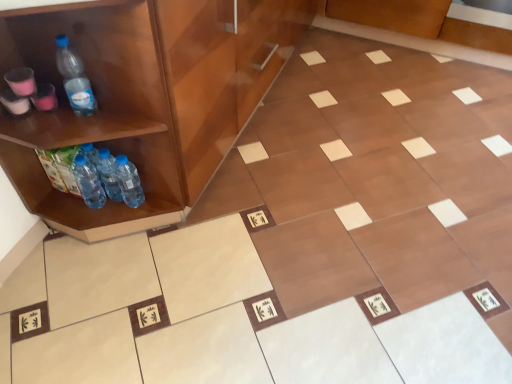
Question: From the image's perspective, is translucent plastic bottles at left, the second bottle positioned from the right, under transparent plastic bottle at left, the 3th bottle positioned from the right?

Choices:
 (A) yes
 (B) no

Answer: (A)

Question: Is translucent plastic bottles at left, the second bottle positioned from the right, looking in the opposite direction of transparent plastic bottle at left, acting as the second bottle starting from the left?

Choices:
 (A) no
 (B) yes

Answer: (A)

Question: Is translucent plastic bottles at left, acting as the third bottle starting from the left, outside transparent plastic bottle at left, acting as the second bottle starting from the left?

Choices:
 (A) no
 (B) yes

Answer: (B)

Question: Considering the relative sizes of translucent plastic bottles at left, the second bottle positioned from the right, and transparent plastic bottle at left, the 3th bottle positioned from the right, in the image provided, is translucent plastic bottles at left, the second bottle positioned from the right, shorter than transparent plastic bottle at left, the 3th bottle positioned from the right,?

Choices:
 (A) no
 (B) yes

Answer: (B)

Question: Is translucent plastic bottles at left, the second bottle positioned from the right, wider than transparent plastic bottle at left, acting as the second bottle starting from the left?

Choices:
 (A) yes
 (B) no

Answer: (A)

Question: Is translucent plastic bottles at left, the second bottle positioned from the right, aimed at transparent plastic bottle at left, the 3th bottle positioned from the right?

Choices:
 (A) yes
 (B) no

Answer: (B)

Question: Can we say translucent plastic bottles at left, the second bottle positioned from the right, lies outside translucent plastic bottles at lower left, the first bottle viewed from the right?

Choices:
 (A) yes
 (B) no

Answer: (A)

Question: Is translucent plastic bottles at left, the second bottle positioned from the right, wider than translucent plastic bottles at lower left, placed as the fourth bottle when sorted from left to right?

Choices:
 (A) no
 (B) yes

Answer: (A)

Question: Can you confirm if translucent plastic bottles at left, the second bottle positioned from the right, is bigger than translucent plastic bottles at lower left, placed as the fourth bottle when sorted from left to right?

Choices:
 (A) yes
 (B) no

Answer: (A)

Question: Could you tell me if translucent plastic bottles at left, acting as the third bottle starting from the left, is turned towards translucent plastic bottles at lower left, the first bottle viewed from the right?

Choices:
 (A) no
 (B) yes

Answer: (A)

Question: Is translucent plastic bottles at left, acting as the third bottle starting from the left, oriented away from translucent plastic bottles at lower left, the first bottle viewed from the right?

Choices:
 (A) no
 (B) yes

Answer: (A)

Question: Is translucent plastic bottles at left, acting as the third bottle starting from the left, directly adjacent to translucent plastic bottles at lower left, the first bottle viewed from the right?

Choices:
 (A) no
 (B) yes

Answer: (B)

Question: Is transparent plastic bottle at left, the 3th bottle positioned from the right, positioned with its back to blue plastic bottle at lower left, which is the 1th bottle in left-to-right order?

Choices:
 (A) yes
 (B) no

Answer: (B)